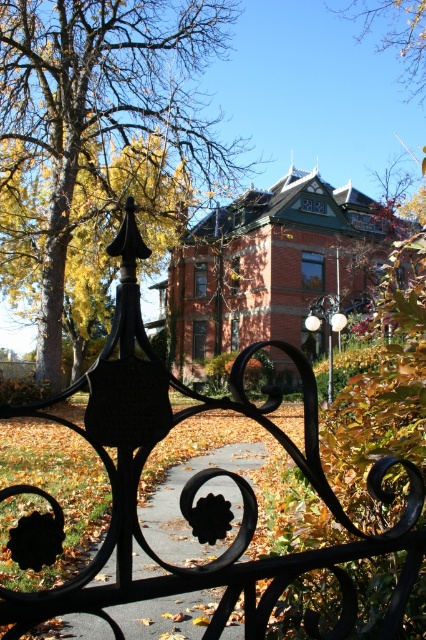
Question: Among these points, which one is farthest from the camera?

Choices:
 (A) (417, 28)
 (B) (29, 45)

Answer: (A)

Question: Observing the image, what is the correct spatial positioning of brown leafy tree at upper left in reference to dark gray concrete path at center?

Choices:
 (A) below
 (B) above

Answer: (B)

Question: Which is farther from the brown leafy tree at upper left?

Choices:
 (A) dark gray concrete path at center
 (B) brown leafy tree at upper center

Answer: (A)

Question: Which point appears farthest from the camera in this image?

Choices:
 (A) [x=393, y=45]
 (B) [x=230, y=628]

Answer: (A)

Question: From the image, what is the correct spatial relationship of brown leafy tree at upper left in relation to dark gray concrete path at center?

Choices:
 (A) right
 (B) left

Answer: (B)

Question: Is brown leafy tree at upper left thinner than brown leafy tree at upper center?

Choices:
 (A) no
 (B) yes

Answer: (A)